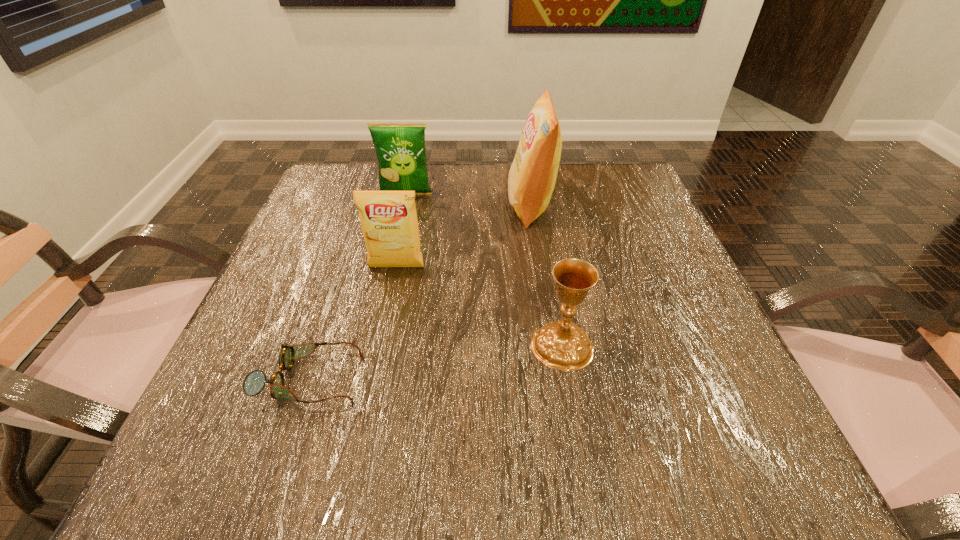
Find the location of a particular element. The height and width of the screenshot is (540, 960). vacant space that's between the tallest crisp (potato chip) and the shortest object is located at coordinates (420, 292).

Locate an element on the screen. The image size is (960, 540). free space between the tallest object and the third nearest object is located at coordinates [x=464, y=237].

Where is `vacant region between the nearest crisp (potato chip) and the chalice`? This screenshot has height=540, width=960. vacant region between the nearest crisp (potato chip) and the chalice is located at coordinates (479, 306).

Image resolution: width=960 pixels, height=540 pixels. In order to click on vacant region between the shortest object and the nearest crisp (potato chip) in this screenshot , I will do `click(352, 323)`.

Locate an element on the screen. The height and width of the screenshot is (540, 960). free space between the third nearest object and the spectacles is located at coordinates (352, 323).

The height and width of the screenshot is (540, 960). Find the location of `unoccupied position between the shortest object and the chalice`. unoccupied position between the shortest object and the chalice is located at coordinates (435, 362).

You are a GUI agent. You are given a task and a screenshot of the screen. Output one action in this format:
    pyautogui.click(x=<x>, y=<y>)
    Task: Click on the blank region between the nearest crisp (potato chip) and the tallest object
    
    Given the screenshot: What is the action you would take?
    pyautogui.click(x=464, y=237)

Identify the location of empty space between the chalice and the nearest crisp (potato chip). (479, 306).

What are the coordinates of `object that is the third nearest to the chalice` in the screenshot? It's located at (254, 382).

This screenshot has height=540, width=960. Identify the location of object that is the third closest one to the spectacles. (531, 180).